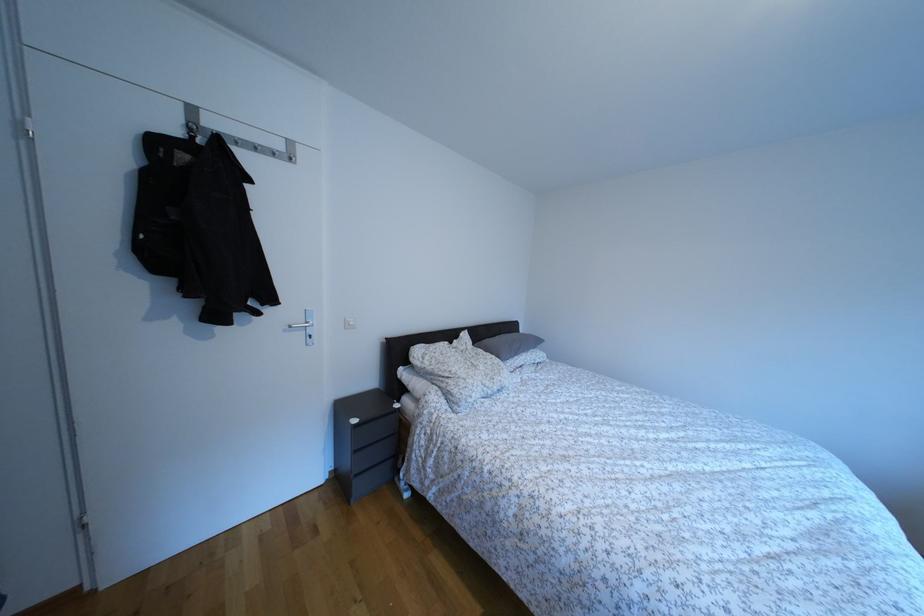
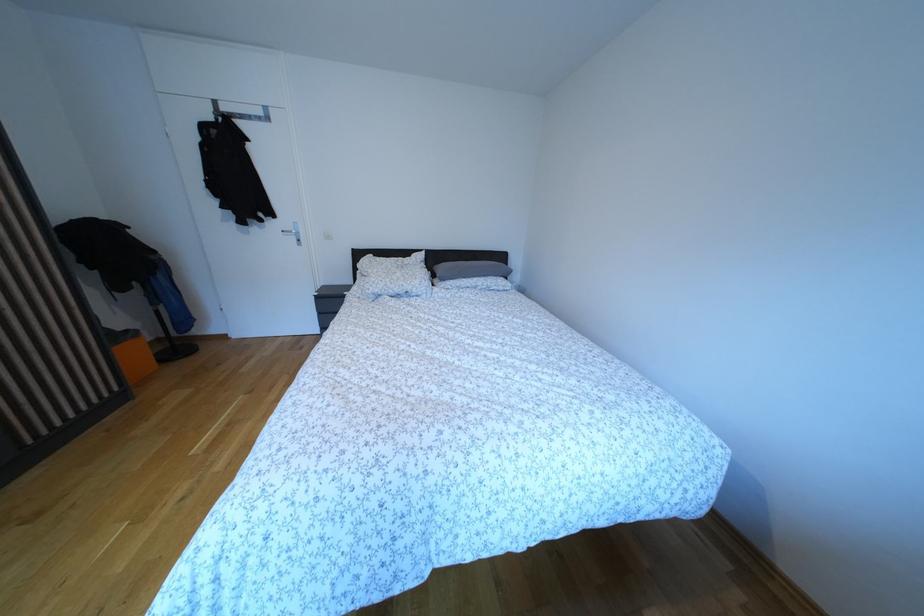
Find the pixel in the second image that matches pixel 489 374 in the first image.

(406, 281)